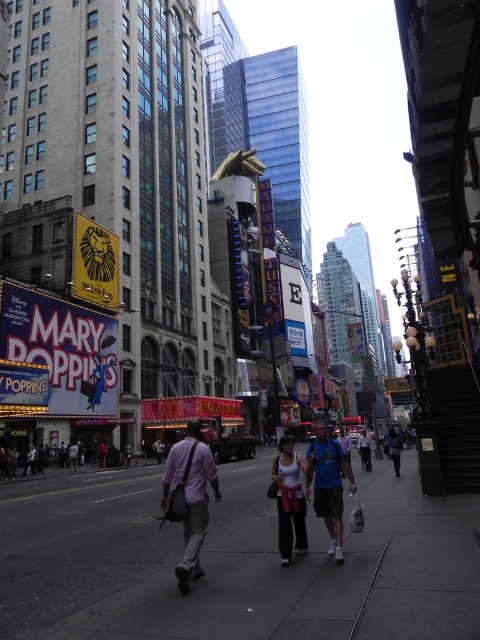
Question: Considering the relative positions of blue fabric shirt at center and matte pink tank top at center in the image provided, where is blue fabric shirt at center located with respect to matte pink tank top at center?

Choices:
 (A) left
 (B) right

Answer: (B)

Question: Does blue fabric shirt at center appear on the left side of blue denim jeans at center?

Choices:
 (A) no
 (B) yes

Answer: (B)

Question: Based on their relative distances, which object is nearer to the concrete sidewalk at center?

Choices:
 (A) blue fabric backpack at center
 (B) blue denim jeans at center
 (C) matte pink tank top at center
 (D) light purple shirt at center

Answer: (D)

Question: Which object is closer to the camera taking this photo?

Choices:
 (A) light purple shirt at center
 (B) matte pink tank top at center

Answer: (A)

Question: Is light purple shirt at center positioned at the back of blue fabric shirt at center?

Choices:
 (A) yes
 (B) no

Answer: (B)

Question: Which point appears closest to the camera in this image?

Choices:
 (A) (357, 444)
 (B) (396, 464)

Answer: (B)